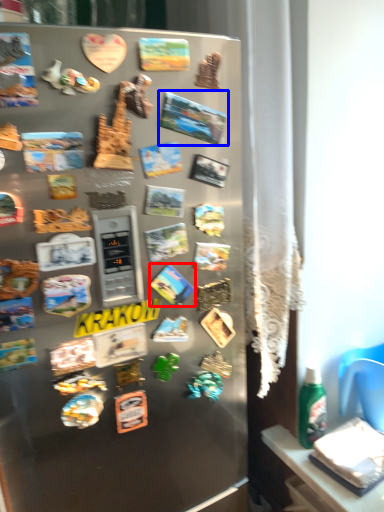
Question: Which of the following is the farthest to the observer, comic book (highlighted by a red box) or comic book (highlighted by a blue box)?

Choices:
 (A) comic book
 (B) comic book

Answer: (A)